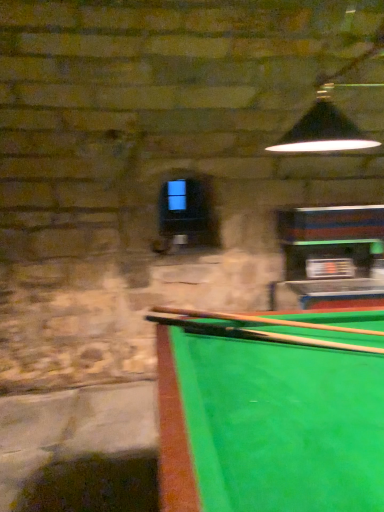
Question: From the image's perspective, is wooden cue at lower right, the 3th cue when ordered from top to bottom, located above or below wooden cue at center, arranged as the 1th cue when viewed from the top?

Choices:
 (A) above
 (B) below

Answer: (B)

Question: Based on their sizes in the image, would you say wooden cue at lower right, which is counted as the first cue, starting from the bottom, is bigger or smaller than wooden cue at center, arranged as the 1th cue when viewed from the top?

Choices:
 (A) small
 (B) big

Answer: (A)

Question: Which object is the closest to the smooth wood cue at center, acting as the second cue starting from the bottom?

Choices:
 (A) wooden cue at center, arranged as the third cue when ordered from the bottom
 (B) wooden cue at lower right, the 3th cue when ordered from top to bottom

Answer: (B)

Question: Estimate the real-world distances between objects in this image. Which object is closer to the smooth wood cue at center, which is counted as the second cue, starting from the top?

Choices:
 (A) wooden cue at lower right, the 3th cue when ordered from top to bottom
 (B) wooden cue at center, arranged as the 1th cue when viewed from the top

Answer: (A)